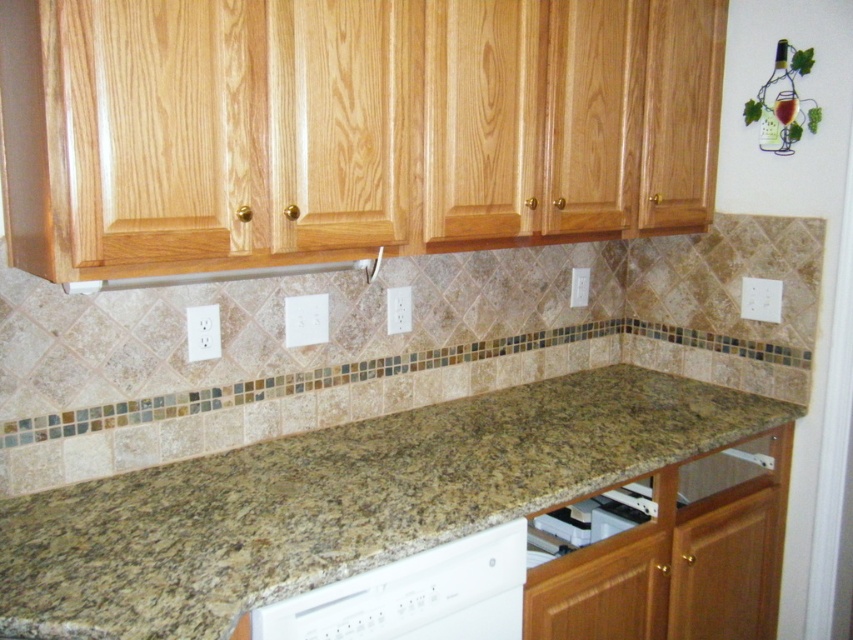
Question: Which object is closer to the camera taking this photo?

Choices:
 (A) white plastic dishwasher at lower center
 (B) white matte dishwasher at lower center

Answer: (B)

Question: Does white matte dishwasher at lower center have a greater width compared to white plastic dishwasher at lower center?

Choices:
 (A) no
 (B) yes

Answer: (B)

Question: Which object appears farthest from the camera in this image?

Choices:
 (A) granite at center
 (B) white plastic dishwasher at lower center

Answer: (B)

Question: Which object is farther from the camera taking this photo?

Choices:
 (A) granite at center
 (B) white plastic dishwasher at lower center

Answer: (B)

Question: Can you confirm if granite at center is smaller than white matte dishwasher at lower center?

Choices:
 (A) no
 (B) yes

Answer: (A)

Question: Does white matte dishwasher at lower center appear over white plastic dishwasher at lower center?

Choices:
 (A) no
 (B) yes

Answer: (A)